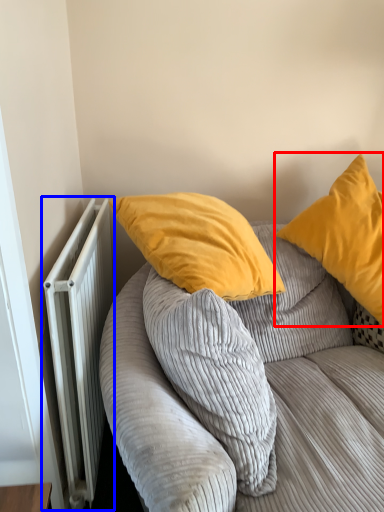
Question: Which of the following is the farthest to the observer, pillow (highlighted by a red box) or radiator (highlighted by a blue box)?

Choices:
 (A) pillow
 (B) radiator

Answer: (A)